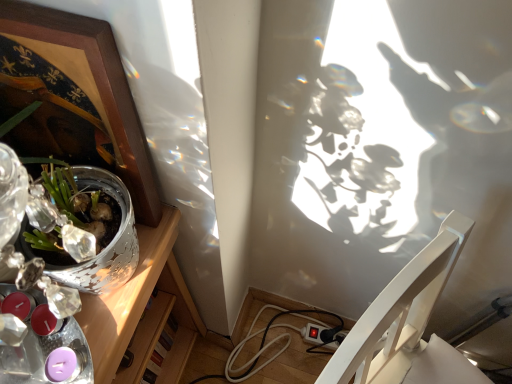
Question: Is silver metallic pot at left behind white glossy chair at lower right?

Choices:
 (A) no
 (B) yes

Answer: (B)

Question: Is silver metallic pot at left wider than white glossy chair at lower right?

Choices:
 (A) yes
 (B) no

Answer: (A)

Question: Does silver metallic pot at left turn towards white glossy chair at lower right?

Choices:
 (A) yes
 (B) no

Answer: (A)

Question: Is silver metallic pot at left shorter than white glossy chair at lower right?

Choices:
 (A) no
 (B) yes

Answer: (B)

Question: Is silver metallic pot at left thinner than white glossy chair at lower right?

Choices:
 (A) no
 (B) yes

Answer: (A)

Question: Is wooden picture frame at upper left situated inside silver metallic pot at left or outside?

Choices:
 (A) outside
 (B) inside

Answer: (A)

Question: From their relative heights in the image, would you say wooden picture frame at upper left is taller or shorter than silver metallic pot at left?

Choices:
 (A) tall
 (B) short

Answer: (B)

Question: From the image's perspective, is wooden picture frame at upper left above or below silver metallic pot at left?

Choices:
 (A) above
 (B) below

Answer: (A)

Question: Looking at their shapes, would you say wooden picture frame at upper left is wider or thinner than silver metallic pot at left?

Choices:
 (A) wide
 (B) thin

Answer: (B)

Question: Considering their positions, is silver metallic pot at left located in front of or behind wooden picture frame at upper left?

Choices:
 (A) behind
 (B) front

Answer: (A)

Question: From the image's perspective, is silver metallic pot at left positioned above or below wooden picture frame at upper left?

Choices:
 (A) above
 (B) below

Answer: (B)

Question: In terms of size, does silver metallic pot at left appear bigger or smaller than wooden picture frame at upper left?

Choices:
 (A) small
 (B) big

Answer: (B)

Question: From a real-world perspective, is silver metallic pot at left physically located above or below wooden picture frame at upper left?

Choices:
 (A) below
 (B) above

Answer: (A)

Question: From a real-world perspective, is white glossy chair at lower right above or below wooden picture frame at upper left?

Choices:
 (A) above
 (B) below

Answer: (B)

Question: From the image's perspective, is white glossy chair at lower right positioned above or below wooden picture frame at upper left?

Choices:
 (A) below
 (B) above

Answer: (A)